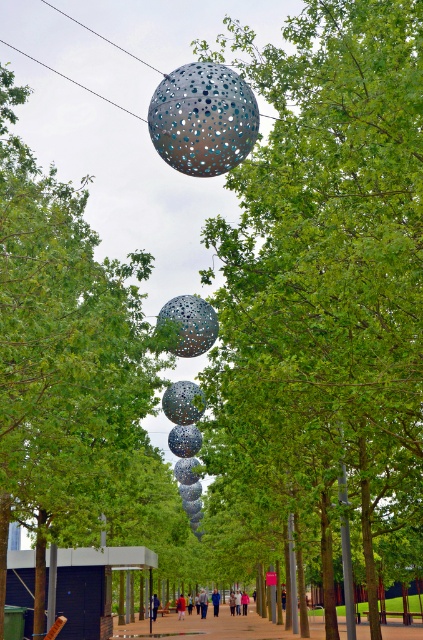
Question: Among these points, which one is nearest to the camera?

Choices:
 (A) (150, 614)
 (B) (246, 364)

Answer: (B)

Question: Can you confirm if green leafy tree at center is positioned to the right of concrete sidewalk at center?

Choices:
 (A) yes
 (B) no

Answer: (A)

Question: Which of the following is the closest to the observer?

Choices:
 (A) (173, 131)
 (B) (181, 600)
 (C) (173, 396)
 (D) (150, 595)

Answer: (A)

Question: Which point is closer to the camera?

Choices:
 (A) (203, 611)
 (B) (35, 323)
 (C) (220, 116)
 (D) (181, 307)

Answer: (B)

Question: Can you confirm if perforated metallic sphere at center is positioned below metallic reflective disco ball at center?

Choices:
 (A) no
 (B) yes

Answer: (A)

Question: Can you confirm if metallic perforated sphere at upper center is positioned to the right of blue fabric jacket at center?

Choices:
 (A) no
 (B) yes

Answer: (B)